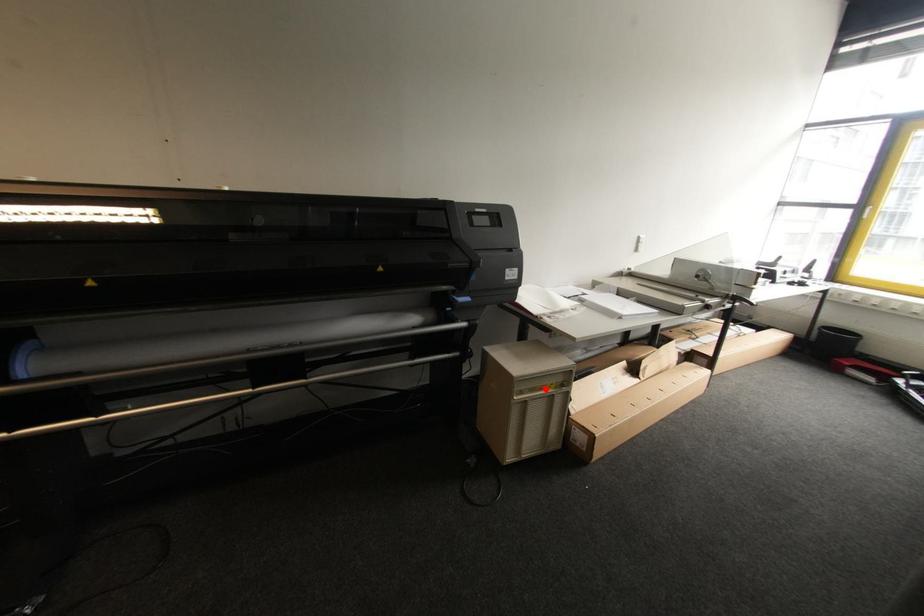
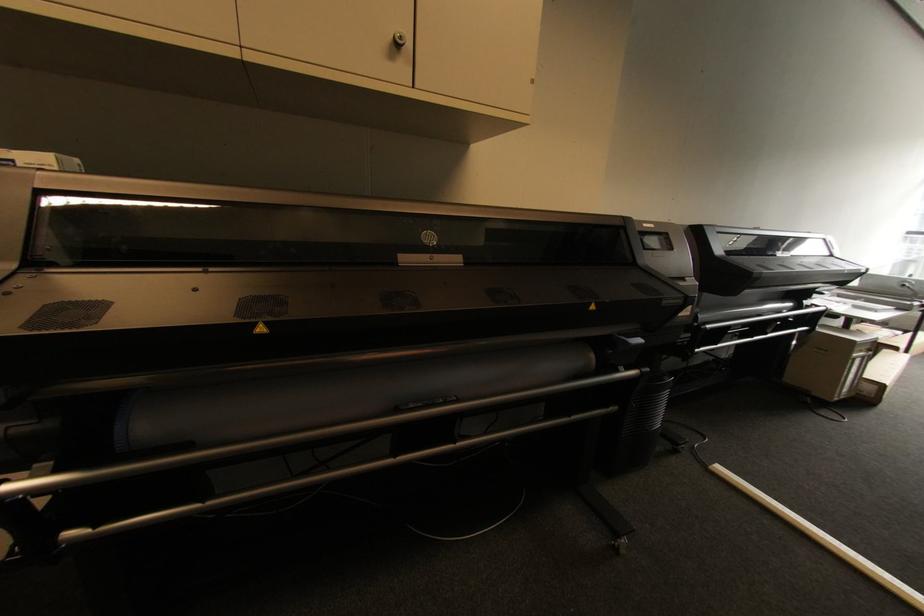
Question: I am providing you with two images of the same scene from different viewpoints. Given a red point in image1, look at the same physical point in image2. Is it:

Choices:
 (A) Closer to the viewpoint
 (B) Farther from the viewpoint

Answer: (A)